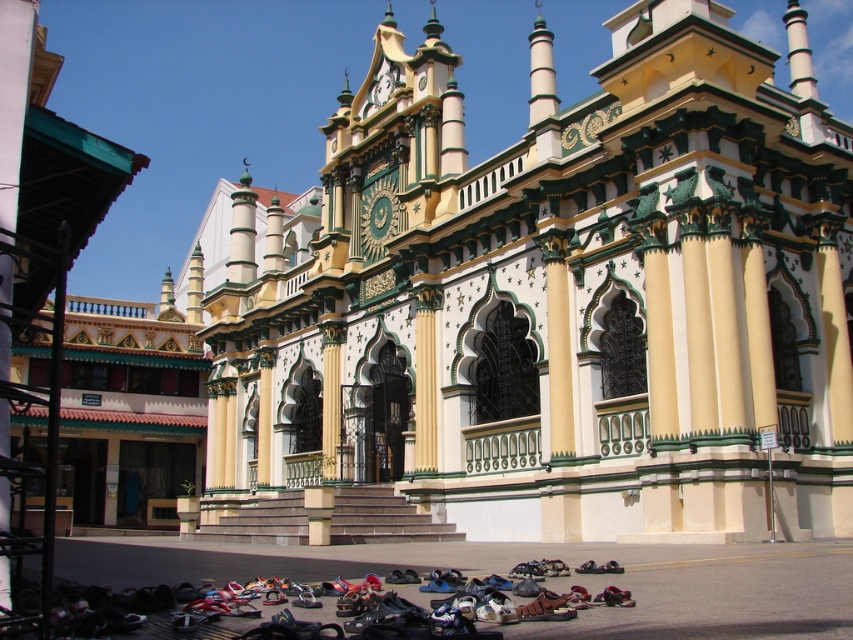
Between yellow painted stone palace at center and leather sandals at lower center, which one is positioned lower?

Positioned lower is leather sandals at lower center.

What do you see at coordinates (556, 298) in the screenshot? The height and width of the screenshot is (640, 853). I see `yellow painted stone palace at center` at bounding box center [556, 298].

Which is in front, point (254, 404) or point (491, 577)?

Positioned in front is point (491, 577).

Identify the location of yellow painted stone palace at center. (556, 298).